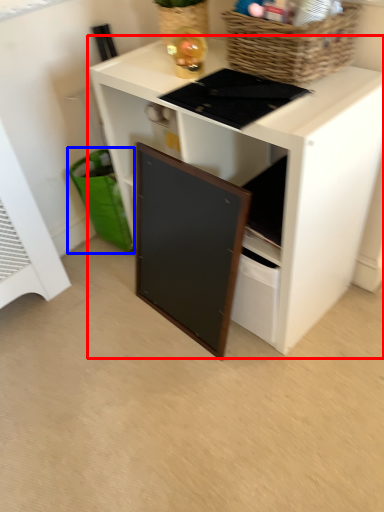
Question: Which object is further to the camera taking this photo, desk (highlighted by a red box) or shopping basket (highlighted by a blue box)?

Choices:
 (A) desk
 (B) shopping basket

Answer: (B)